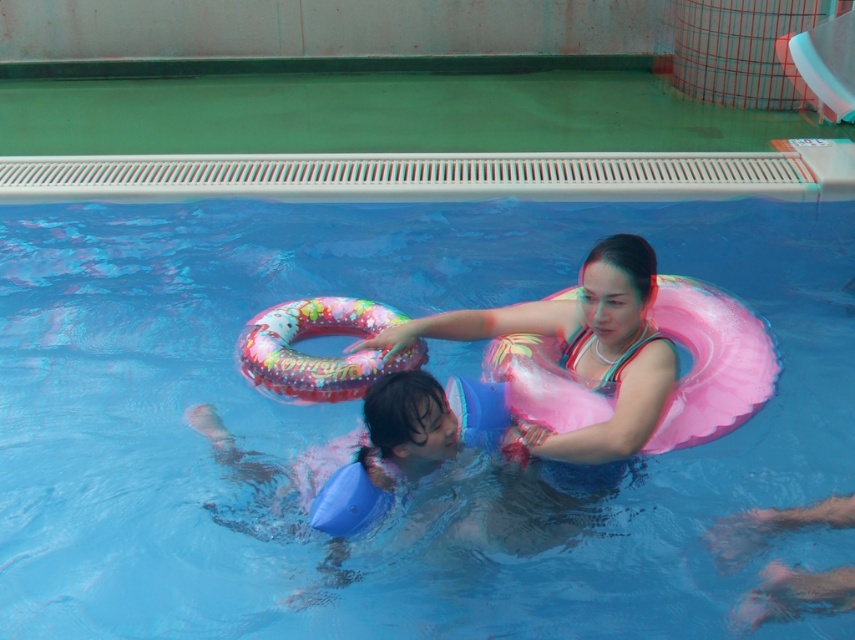
You are a lifeguard observing the pool area. You notice two flotation devices in the water. The blue rubber ring at center and the matte pink float at center. Which flotation device is closer to you?

The blue rubber ring at center is closer to you because it is further to the viewer than the matte pink float at center.

You are standing at the edge of the pool and want to swim to the point labeled point (16, 573). However, there is an obstacle at point (614, 339). Will you pass in front of or behind the obstacle?

Since point (16, 573) is behind point (614, 339), you will pass behind the obstacle at point (614, 339) when swimming to point (16, 573).

You are a lifeguard observing the two flotation devices in the pool. The blue rubber ring at center is used by a child, and the matte pink float at center is used by an adult. Based on their sizes, which flotation device would you recommend for a toddler needing more buoyancy?

The matte pink float at center is taller than the blue rubber ring at center, so it provides more buoyancy and would be suitable for a toddler needing extra support.